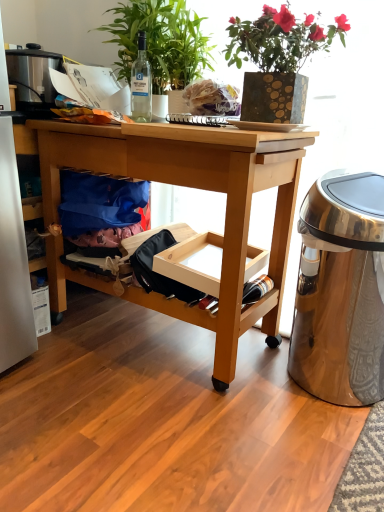
Question: Does point (102, 179) appear closer or farther from the camera than point (190, 31)?

Choices:
 (A) closer
 (B) farther

Answer: (B)

Question: In the image, is blue fabric bag at lower left positioned in front of or behind green leafy plant at upper center, which appears as the first houseplant when viewed from the left?

Choices:
 (A) front
 (B) behind

Answer: (B)

Question: Which of these objects is positioned farthest from the polished metallic trash can at right?

Choices:
 (A) blue fabric bag at lower left
 (B) white matte plate at center
 (C) gold textured vase at upper center, the 3th houseplant in the left-to-right sequence
 (D) light wood desk at center
 (E) green leafy plant at upper center, which appears as the first houseplant when viewed from the left

Answer: (E)

Question: Which object is the closest to the gold textured vase at upper center, the 3th houseplant in the left-to-right sequence?

Choices:
 (A) blue fabric bag at lower left
 (B) green leafy plant at upper center, which is the 2th houseplant from right to left
 (C) polished metallic trash can at right
 (D) stainless steel microwave at upper left
 (E) green leafy plant at upper center, which is the third houseplant in right-to-left order

Answer: (B)